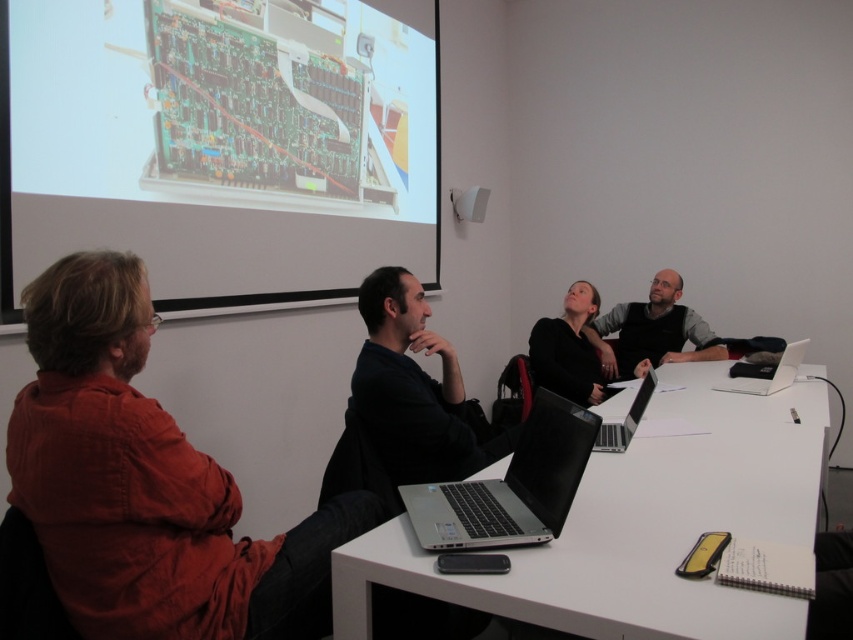
Can you confirm if matte black circuit board at upper left is thinner than dark blue shirt at center?

In fact, matte black circuit board at upper left might be wider than dark blue shirt at center.

Which is above, matte black circuit board at upper left or dark blue shirt at center?

matte black circuit board at upper left is higher up.

Is point (244, 180) in front of point (439, 481)?

That is False.

Find the location of `matte black circuit board at upper left`. matte black circuit board at upper left is located at coordinates (219, 144).

Is dark gray sweater at center above silver metallic laptop at center?

Indeed, dark gray sweater at center is positioned over silver metallic laptop at center.

From the picture: Is dark gray sweater at center thinner than silver metallic laptop at center?

In fact, dark gray sweater at center might be wider than silver metallic laptop at center.

Does point (660, 308) come farther from viewer compared to point (607, 449)?

Yes, point (660, 308) is farther from viewer.

Identify the location of dark gray sweater at center. This screenshot has width=853, height=640. (653, 332).

Can you confirm if reddish-brown shirt at left is positioned to the left of white glossy table at center?

Yes, reddish-brown shirt at left is to the left of white glossy table at center.

Is point (74, 362) farther from camera compared to point (692, 637)?

Yes, point (74, 362) is behind point (692, 637).

Find the location of a particular element. reddish-brown shirt at left is located at coordinates (146, 483).